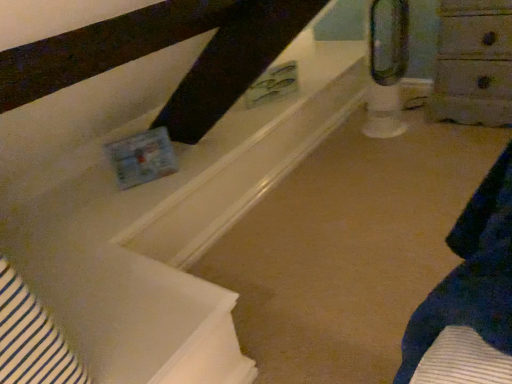
Locate an element on the screen. The width and height of the screenshot is (512, 384). white wood chest of drawers at upper right is located at coordinates [474, 63].

This screenshot has width=512, height=384. Describe the element at coordinates (474, 63) in the screenshot. I see `white wood chest of drawers at upper right` at that location.

This screenshot has height=384, width=512. I want to click on white wood chest of drawers at upper right, so click(x=474, y=63).